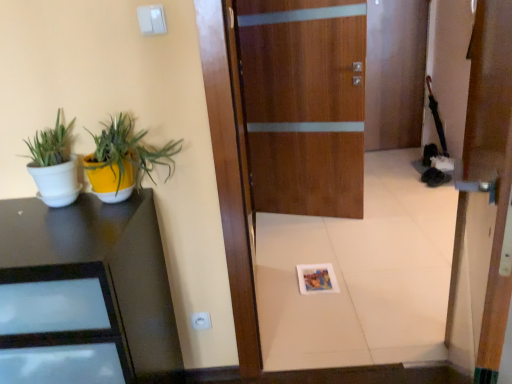
Question: Which direction should I rotate to look at wooden door at center, the 1th door in the back-to-front sequence?

Choices:
 (A) left
 (B) right

Answer: (B)

Question: Which direction should I rotate to look at wooden door at center, arranged as the second door when viewed from the back?

Choices:
 (A) right
 (B) left

Answer: (A)

Question: From a real-world perspective, is white plastic electric outlet at lower center beneath white matte pot at left, which is the second houseplant in right-to-left order?

Choices:
 (A) yes
 (B) no

Answer: (A)

Question: Is white plastic electric outlet at lower center turned away from white matte pot at left, which is the second houseplant in right-to-left order?

Choices:
 (A) yes
 (B) no

Answer: (B)

Question: From a real-world perspective, does white plastic electric outlet at lower center stand above white matte pot at left, the first houseplant from the left?

Choices:
 (A) yes
 (B) no

Answer: (B)

Question: Is white plastic electric outlet at lower center thinner than white matte pot at left, which is the second houseplant in right-to-left order?

Choices:
 (A) yes
 (B) no

Answer: (A)

Question: Does white plastic electric outlet at lower center appear on the right side of white matte pot at left, which is the second houseplant in right-to-left order?

Choices:
 (A) yes
 (B) no

Answer: (A)

Question: Considering the relative sizes of white plastic electric outlet at lower center and white matte pot at left, the first houseplant from the left, in the image provided, is white plastic electric outlet at lower center wider than white matte pot at left, the first houseplant from the left,?

Choices:
 (A) yes
 (B) no

Answer: (B)

Question: From a real-world perspective, does white plastic electric outlet at lower center stand above yellow matte pot at left, the second houseplant from the left?

Choices:
 (A) yes
 (B) no

Answer: (B)

Question: Does white plastic electric outlet at lower center appear on the left side of yellow matte pot at left, the second houseplant from the left?

Choices:
 (A) no
 (B) yes

Answer: (A)

Question: Is white plastic electric outlet at lower center oriented towards yellow matte pot at left, which appears as the first houseplant when viewed from the right?

Choices:
 (A) yes
 (B) no

Answer: (B)

Question: Does white plastic electric outlet at lower center contain yellow matte pot at left, which appears as the first houseplant when viewed from the right?

Choices:
 (A) no
 (B) yes

Answer: (A)

Question: From a real-world perspective, is white plastic electric outlet at lower center below yellow matte pot at left, which appears as the first houseplant when viewed from the right?

Choices:
 (A) yes
 (B) no

Answer: (A)

Question: Can you confirm if white plastic electric outlet at lower center is thinner than yellow matte pot at left, the second houseplant from the left?

Choices:
 (A) no
 (B) yes

Answer: (B)

Question: Does white matte pot at left, which is the second houseplant in right-to-left order, appear on the right side of wooden door at center, marked as the first door in a front-to-back arrangement?

Choices:
 (A) yes
 (B) no

Answer: (B)